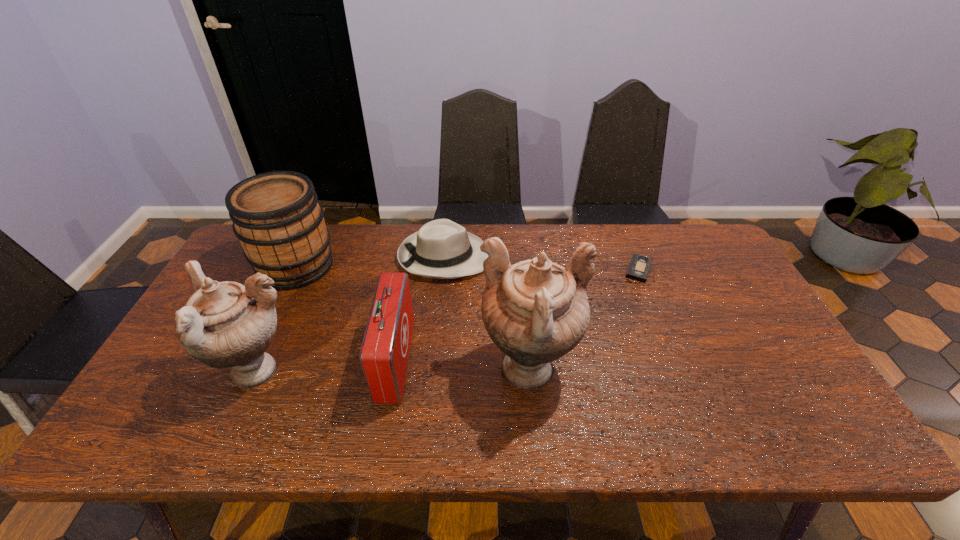
Find the location of `object that can be found as the closest to the first-aid kit`. object that can be found as the closest to the first-aid kit is located at coordinates (442, 249).

Image resolution: width=960 pixels, height=540 pixels. I want to click on free region that satisfies the following two spatial constraints: 1. on the front-facing side of the fedora; 2. on the front side of the shorter urn, so click(434, 373).

The width and height of the screenshot is (960, 540). Find the location of `free space that satisfies the following two spatial constraints: 1. on the back side of the right urn; 2. on the front-facing side of the fedora`. free space that satisfies the following two spatial constraints: 1. on the back side of the right urn; 2. on the front-facing side of the fedora is located at coordinates (518, 257).

You are a GUI agent. You are given a task and a screenshot of the screen. Output one action in this format:
    pyautogui.click(x=<x>, y=<y>)
    Task: Click on the free space that satisfies the following two spatial constraints: 1. on the front-facing side of the second shortest object; 2. on the right side of the rightmost object
    The height and width of the screenshot is (540, 960).
    Given the screenshot: What is the action you would take?
    pyautogui.click(x=444, y=269)

The height and width of the screenshot is (540, 960). Identify the location of free space that satisfies the following two spatial constraints: 1. on the front side of the shortest object; 2. on the right side of the cider. (294, 269).

At what (x,y) coordinates should I click in order to perform the action: click on vacant area that satisfies the following two spatial constraints: 1. on the back side of the taller urn; 2. on the front-facing side of the second shortest object. Please return your answer as a coordinate pair (x, y). Looking at the image, I should click on (518, 257).

Find the location of a particular element. The image size is (960, 540). vacant region that satisfies the following two spatial constraints: 1. on the back side of the tallest object; 2. on the front-facing side of the second shortest object is located at coordinates (518, 257).